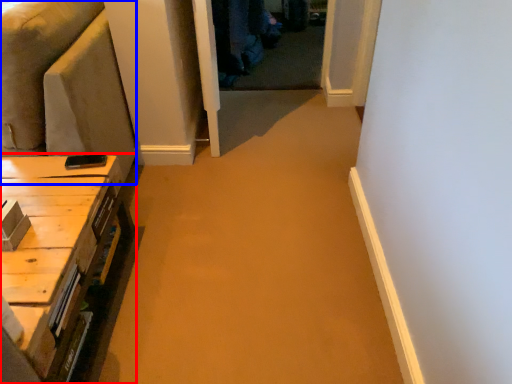
Question: Which object appears closest to the camera in this image, table (highlighted by a red box) or couch (highlighted by a blue box)?

Choices:
 (A) table
 (B) couch

Answer: (A)